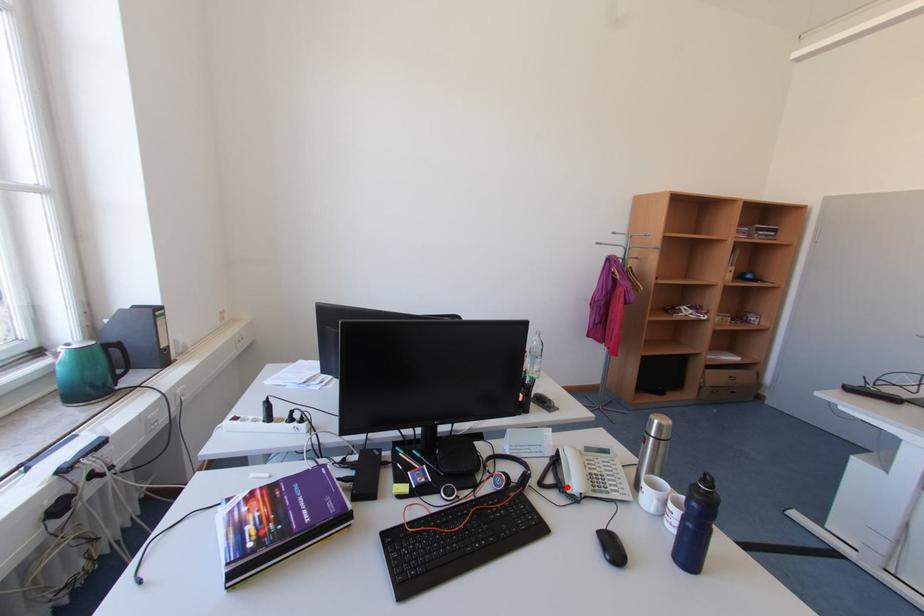
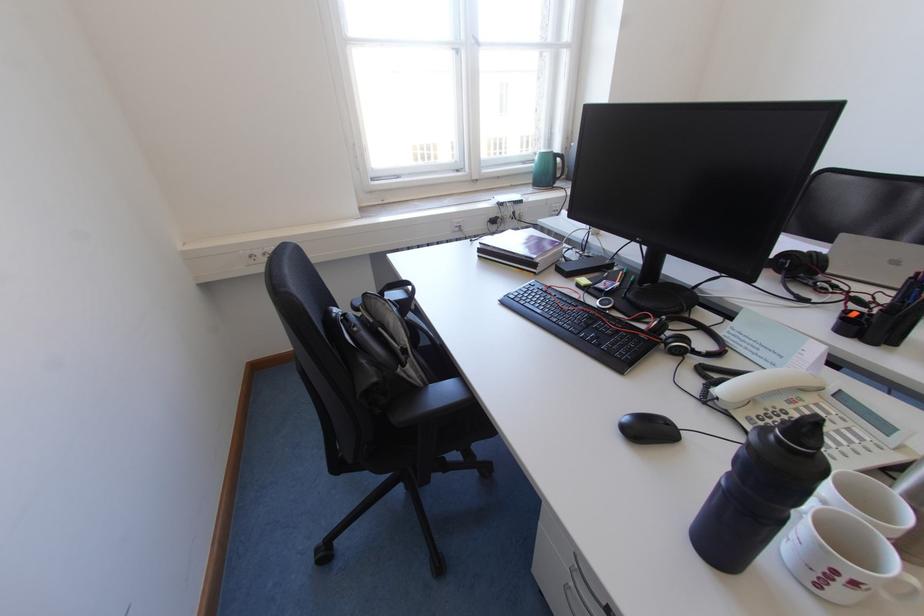
In the second image, find the point that corresponds to the highlighted location in the first image.

(723, 384)